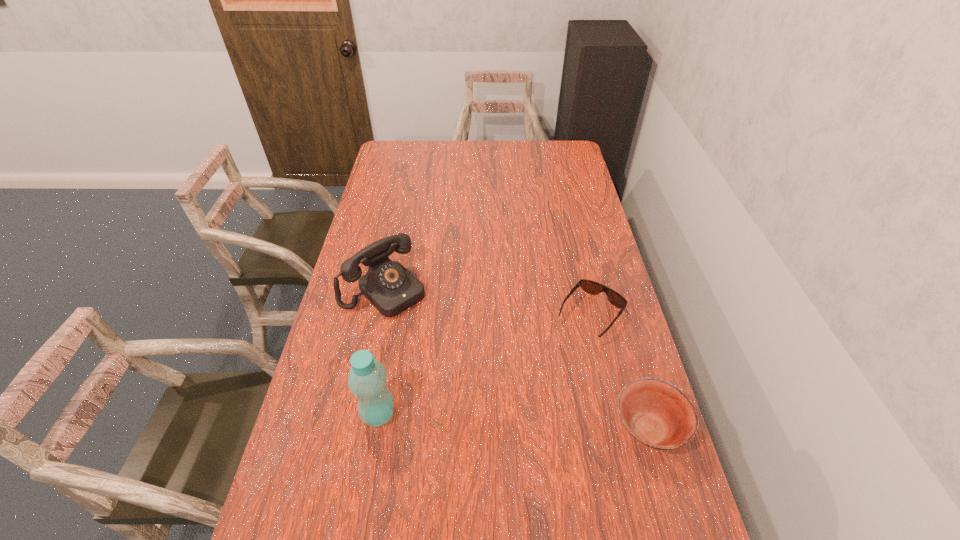
Locate an element on the screen. This screenshot has height=540, width=960. free space at the far right corner of the desktop is located at coordinates (549, 157).

The height and width of the screenshot is (540, 960). I want to click on free area in between the sunglasses and the second shortest object, so click(619, 373).

Locate an element on the screen. unoccupied area between the second shortest object and the bottle is located at coordinates (513, 422).

Find the location of `free space between the third tallest object and the bottle`. free space between the third tallest object and the bottle is located at coordinates (513, 422).

Locate an element on the screen. The image size is (960, 540). blank region between the second shortest object and the bottle is located at coordinates (513, 422).

The height and width of the screenshot is (540, 960). What are the coordinates of `vacant point located between the third shortest object and the second shortest object` in the screenshot? It's located at (516, 360).

Identify the location of vacant space that is in between the sunglasses and the tallest object. coord(485,364).

Where is `empty location between the bottle and the sunglasses`? empty location between the bottle and the sunglasses is located at coordinates (485, 364).

Locate an element on the screen. The height and width of the screenshot is (540, 960). free area in between the tallest object and the second shortest object is located at coordinates (513, 422).

Identify the location of vacant area that lies between the tallest object and the bowl. (513, 422).